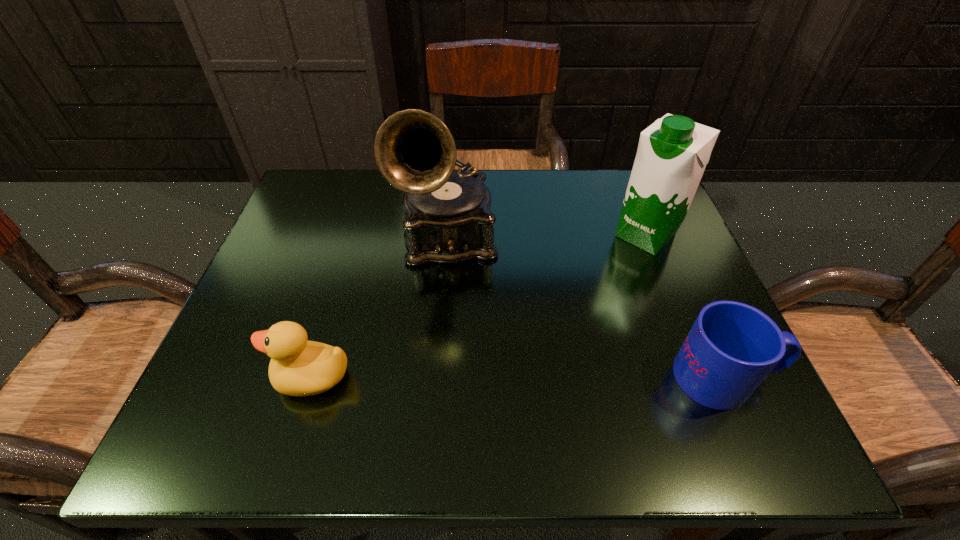
Where is `object present at the near right corner`? This screenshot has width=960, height=540. object present at the near right corner is located at coordinates (731, 348).

What are the coordinates of `free space at the far edge of the desktop` in the screenshot? It's located at (564, 218).

In the image, there is a desktop. What are the coordinates of `vacant space at the near edge` in the screenshot? It's located at (478, 356).

The height and width of the screenshot is (540, 960). What are the coordinates of `free spot at the left edge of the desktop` in the screenshot? It's located at (225, 342).

In the image, there is a desktop. Identify the location of vacant space at the right edge. (672, 318).

Identify the location of vacant space at the far left corner of the desktop. The height and width of the screenshot is (540, 960). (327, 186).

Image resolution: width=960 pixels, height=540 pixels. What are the coordinates of `vacant space at the near left corner` in the screenshot? It's located at (245, 390).

What are the coordinates of `free region at the far right corner of the desktop` in the screenshot? It's located at (592, 183).

Identify the location of free spot between the soya milk and the phonograph record. The width and height of the screenshot is (960, 540). (547, 236).

The image size is (960, 540). I want to click on vacant region between the mug and the leftmost object, so click(519, 377).